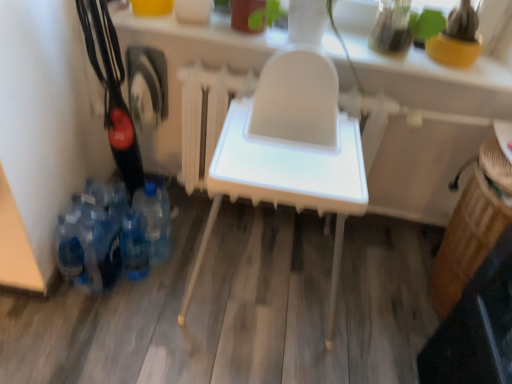
Image resolution: width=512 pixels, height=384 pixels. In order to click on unoccupied space behind blue plastic bottle at lower left, arranged as the first bottle when viewed from the right in this screenshot , I will do `click(184, 224)`.